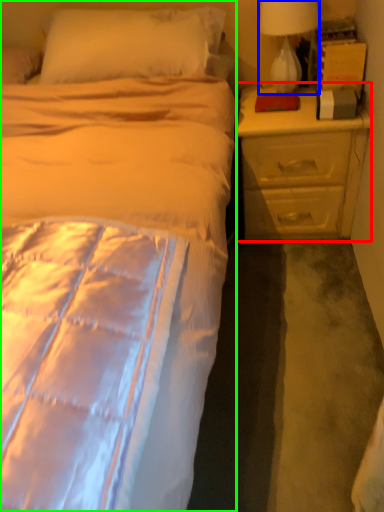
Question: Considering the real-world distances, which object is farthest from nightstand (highlighted by a red box)? lamp (highlighted by a blue box) or bed (highlighted by a green box)?

Choices:
 (A) lamp
 (B) bed

Answer: (B)